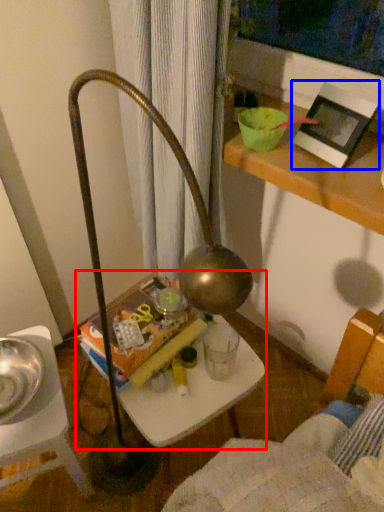
Question: Which of the following is the closest to the observer, table (highlighted by a red box) or picture frame (highlighted by a blue box)?

Choices:
 (A) table
 (B) picture frame

Answer: (B)